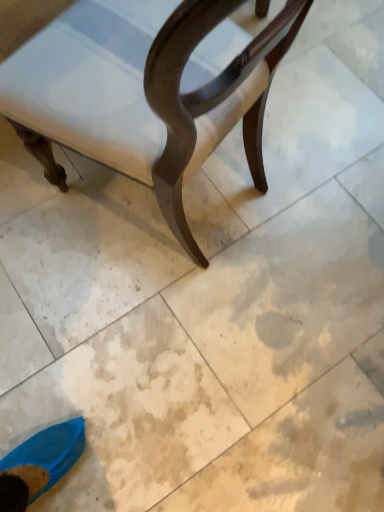
Where is `vacant space underneath glossy wood chair at upper center (from a real-world perspective)`? vacant space underneath glossy wood chair at upper center (from a real-world perspective) is located at coordinates (156, 211).